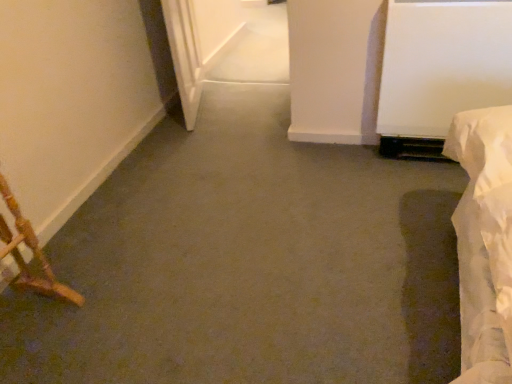
The width and height of the screenshot is (512, 384). I want to click on white glossy door at upper left, so click(184, 57).

In order to face white glossy door at upper left, should I rotate leftwards or rightwards?

You should look left and rotate roughly 9.219 degrees.

What do you see at coordinates (184, 57) in the screenshot?
I see `white glossy door at upper left` at bounding box center [184, 57].

The width and height of the screenshot is (512, 384). Identify the location of white glossy door at upper left. (184, 57).